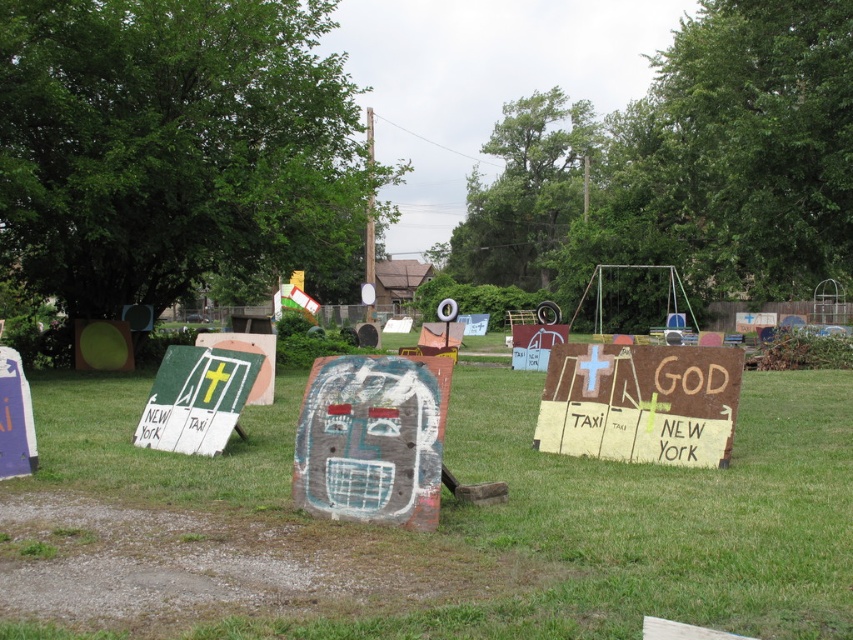
Consider the image. You are standing at the point marked by the coordinates point (521,513) in the image. Based on the scene description, what is the surface you are standing on?

The surface at point (521,513) is green grass at center.

You are standing at the point marked as point (372,438) in the image. What object are you standing on?

You are standing on the rusty wood sign at center.

You are standing at the origin point of the coordinate system in the park. You need to locate the rusty wood sign at center. What are its coordinates?

The rusty wood sign at center is located at coordinates point [372,438].